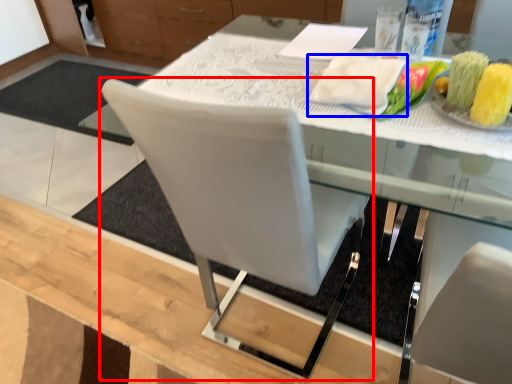
Question: Among these objects, which one is farthest to the camera, chair (highlighted by a red box) or cloth (highlighted by a blue box)?

Choices:
 (A) chair
 (B) cloth

Answer: (B)